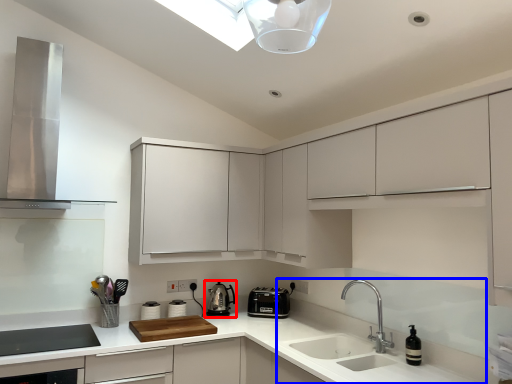
Question: Among these objects, which one is farthest to the camera, kitchen appliance (highlighted by a red box) or sink (highlighted by a blue box)?

Choices:
 (A) kitchen appliance
 (B) sink

Answer: (A)